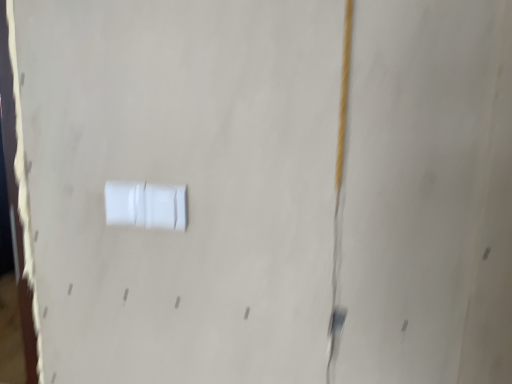
Describe the element at coordinates (146, 205) in the screenshot. I see `white plastic switch at center` at that location.

Measure the distance between point (140, 189) and camera.

They are 31.69 inches apart.

Locate an element on the screen. This screenshot has width=512, height=384. white plastic switch at center is located at coordinates (146, 205).

In order to face white plastic switch at center, should I rotate leftwards or rightwards?

You should look left and rotate roughly 14.151 degrees.

Find the location of `white plastic switch at center`. white plastic switch at center is located at coordinates (146, 205).